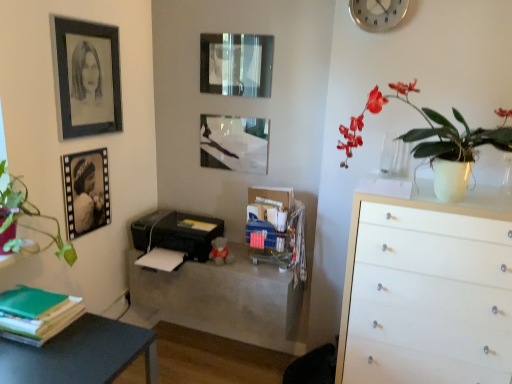
Question: Is the depth of matte black picture frame at upper center, marked as the fourth picture frame in a left-to-right arrangement, less than that of matte black printer at center?

Choices:
 (A) no
 (B) yes

Answer: (A)

Question: Is the position of matte black picture frame at upper center, placed as the first picture frame when sorted from right to left, more distant than that of matte black printer at center?

Choices:
 (A) yes
 (B) no

Answer: (A)

Question: Does matte black picture frame at upper center, placed as the first picture frame when sorted from right to left, have a greater width compared to matte black printer at center?

Choices:
 (A) yes
 (B) no

Answer: (B)

Question: Is matte black picture frame at upper center, marked as the fourth picture frame in a left-to-right arrangement, surrounding matte black printer at center?

Choices:
 (A) no
 (B) yes

Answer: (A)

Question: Is matte black picture frame at upper center, marked as the fourth picture frame in a left-to-right arrangement, smaller than matte black printer at center?

Choices:
 (A) no
 (B) yes

Answer: (B)

Question: Considering the relative sizes of matte black picture frame at upper center, placed as the first picture frame when sorted from right to left, and matte white vase at upper right in the image provided, is matte black picture frame at upper center, placed as the first picture frame when sorted from right to left, wider than matte white vase at upper right?

Choices:
 (A) no
 (B) yes

Answer: (A)

Question: From the image's perspective, is matte black picture frame at upper center, placed as the first picture frame when sorted from right to left, on matte white vase at upper right?

Choices:
 (A) yes
 (B) no

Answer: (A)

Question: Can you confirm if matte black picture frame at upper center, marked as the fourth picture frame in a left-to-right arrangement, is shorter than matte white vase at upper right?

Choices:
 (A) no
 (B) yes

Answer: (B)

Question: Are matte black picture frame at upper center, placed as the first picture frame when sorted from right to left, and matte white vase at upper right beside each other?

Choices:
 (A) no
 (B) yes

Answer: (A)

Question: Is matte black picture frame at upper center, placed as the first picture frame when sorted from right to left, completely or partially outside of matte white vase at upper right?

Choices:
 (A) no
 (B) yes

Answer: (B)

Question: Does matte black picture frame at upper center, marked as the fourth picture frame in a left-to-right arrangement, turn towards matte white vase at upper right?

Choices:
 (A) yes
 (B) no

Answer: (B)

Question: Can you confirm if matte black picture frame at center, which is counted as the 3th picture frame, starting from the left, is thinner than matte white vase at upper right?

Choices:
 (A) no
 (B) yes

Answer: (B)